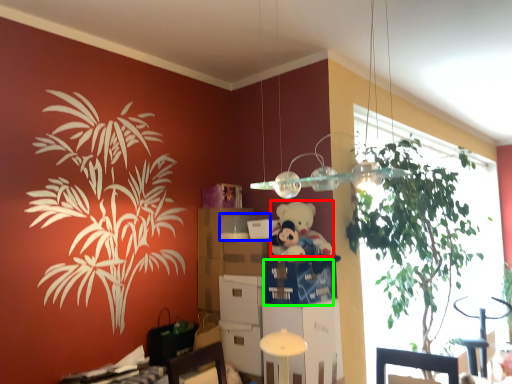
Question: Which object is positioned farthest from teddy (highlighted by a red box)? Select from box (highlighted by a blue box) and drawer (highlighted by a green box).

Choices:
 (A) box
 (B) drawer

Answer: (A)